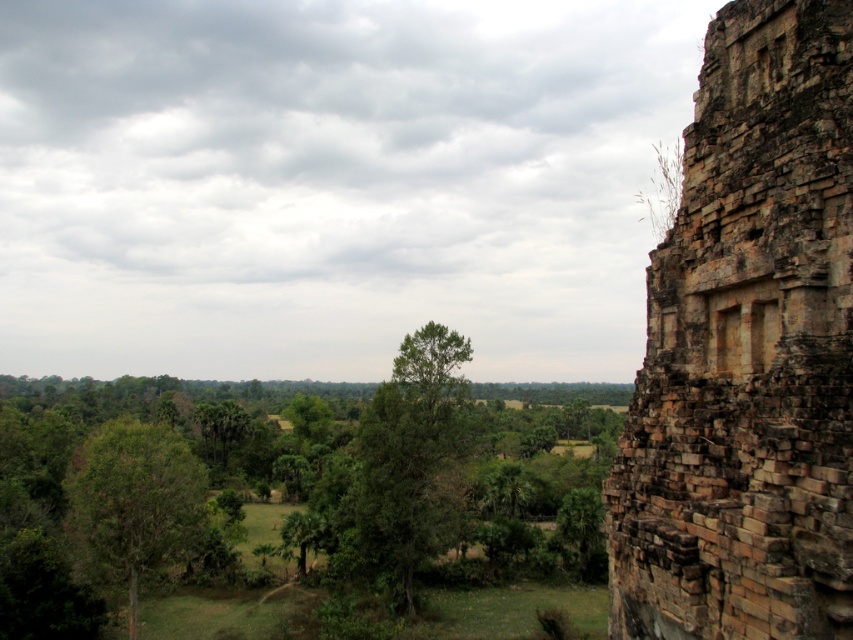
You are an archaeologist standing on the ancient ruin and want to compare the sizes of the brown stone wall at right and the green leafy tree at left. Which one is wider?

The brown stone wall at right is less wide than the green leafy tree at left, so the green leafy tree at left is wider.

You are standing on the ancient ruin and looking out. Which object is closer to you between the brown stone wall at right and the green leafy tree at center?

The brown stone wall at right is closer to you as it is positioned in front of the green leafy tree at center.

You are an archaeologist standing on the weathered stone wall of the ancient ruin. You notice two green leafy trees in the midground. Which tree would appear closer to you, the green leafy tree at center or the green leafy tree at left?

The green leafy tree at center is smaller than the green leafy tree at left, so the tree at center would appear closer because smaller objects in the distance can sometimes appear closer due to perspective, but in this case, since the tree at center is smaller, it might actually be farther away. Wait, this is confusing. Let me think again. Hmm, in perspective, closer objects appear larger. If the center tree is smaller, it is likely farther away. So the answer should be the left tree is larger and thus is a